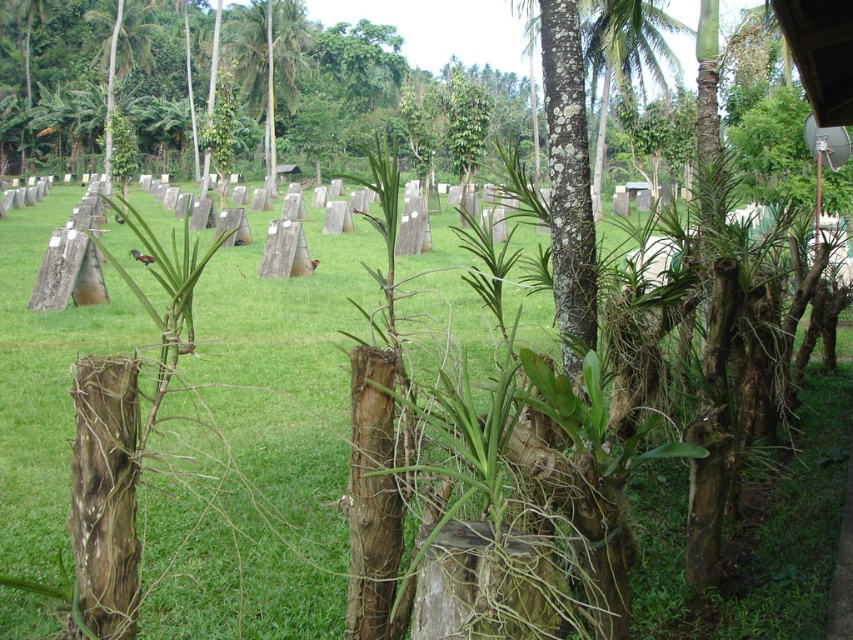
Is green leafy palm tree at center to the right of green leafy palm tree at upper left from the viewer's perspective?

Indeed, green leafy palm tree at center is positioned on the right side of green leafy palm tree at upper left.

Describe the element at coordinates (270, 58) in the screenshot. This screenshot has height=640, width=853. I see `green leafy palm tree at center` at that location.

Where is `green leafy palm tree at center`? green leafy palm tree at center is located at coordinates (270, 58).

Between green grass at center and green leafy palm tree at center, which one is positioned lower?

green grass at center is below.

What do you see at coordinates (257, 449) in the screenshot?
I see `green grass at center` at bounding box center [257, 449].

Is point (334, 269) less distant than point (282, 88)?

Yes, point (334, 269) is closer to viewer.

Locate an element on the screen. This screenshot has height=640, width=853. green grass at center is located at coordinates (257, 449).

Measure the distance between green grass at center and green leafy palm tree at upper left.

The distance of green grass at center from green leafy palm tree at upper left is 27.16 meters.

Between point (59, 508) and point (107, 97), which one is positioned behind?

Positioned behind is point (107, 97).

At what (x,y) coordinates should I click in order to perform the action: click on green grass at center. Please return your answer as a coordinate pair (x, y). This screenshot has width=853, height=640. Looking at the image, I should click on (257, 449).